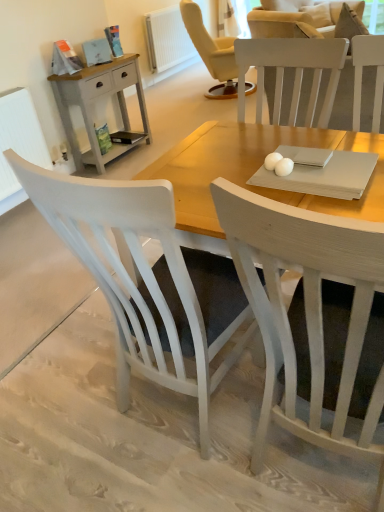
In order to click on free region under white wood chair at center, which is the first chair from right to left (from a real-world perspective) in this screenshot , I will do `click(310, 476)`.